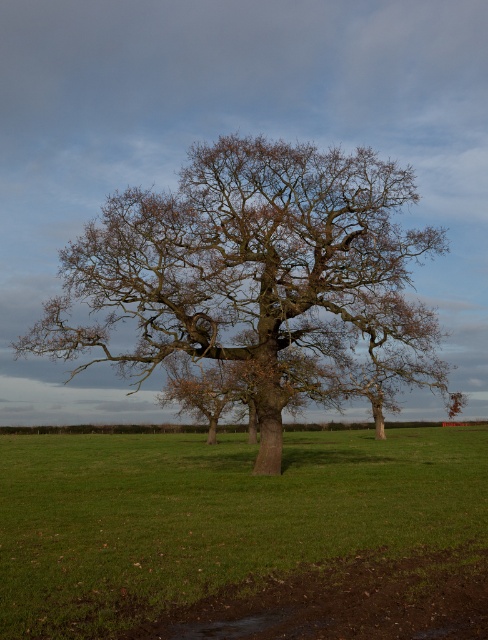
You are standing at the origin point of the image coordinate system, which is the bottom left corner. You want to walk directly towards the brown rough bark oak tree at center. In which direction should you move first? Please answer with either left, right, up, or down.

The brown rough bark oak tree at center is located at point (x=258, y=278) in the image coordinate system. Since the origin is at the bottom left corner, the x increases to the right and y increases upwards. To reach the tree, starting at the origin, you need to move right and up. However, since the question asks for the first direction to move, you should move right first because the x coordinate is 0.436, which is to the right of the origin, and the y coordinate is 0.529 upwards.

You are standing in the middle of a field and see a point marked at coordinates (258, 278). What does this point represent?

The point at coordinates (258, 278) represents the brown rough bark oak tree at center.

You are a gardener planning to plant flowers in the green grass at center. Considering the brown rough bark oak tree at center is above the grass, will the flowers receive enough sunlight?

The brown rough bark oak tree at center is positioned over the green grass at center, so the flowers planted there may not receive enough sunlight due to the tree casting shade over the grass.